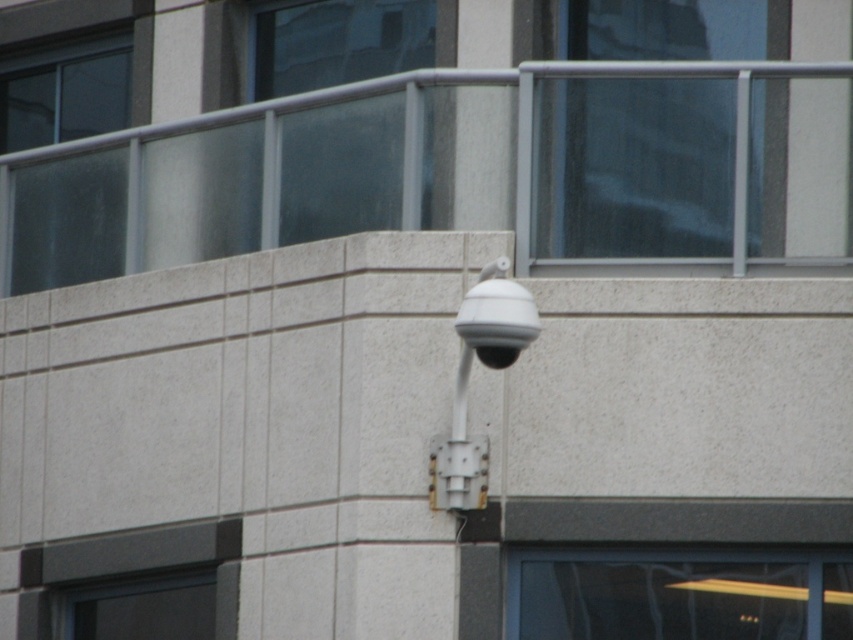
Question: Which object appears closest to the camera in this image?

Choices:
 (A) transparent glass window at lower right
 (B) transparent glass window at upper left

Answer: (A)

Question: Can you confirm if transparent glass window at lower right is positioned above transparent glass at upper center?

Choices:
 (A) no
 (B) yes

Answer: (A)

Question: Which of the following is the farthest from the observer?

Choices:
 (A) (392, 65)
 (B) (761, 108)

Answer: (A)

Question: Does transparent glass at upper center appear on the right side of dark gray concrete window at lower left?

Choices:
 (A) yes
 (B) no

Answer: (A)

Question: Which object is closer to the camera taking this photo?

Choices:
 (A) dark gray concrete window at lower left
 (B) transparent glass window at upper left

Answer: (A)

Question: Does transparent glass window at upper center have a lesser width compared to transparent glass at upper center?

Choices:
 (A) no
 (B) yes

Answer: (B)